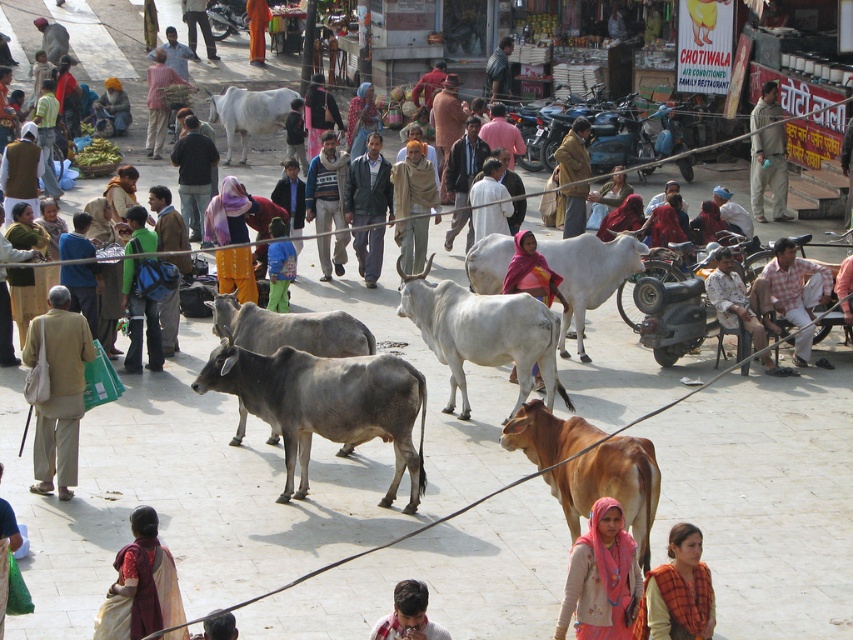
Is point (271, 358) more distant than point (515, 360)?

No, it is in front of (515, 360).

Is gray smooth bull at center thinner than white glossy bull at center?

In fact, gray smooth bull at center might be wider than white glossy bull at center.

Which is behind, point (271, 403) or point (451, 364)?

The point (451, 364) is more distant.

At what (x,y) coordinates should I click in order to perform the action: click on gray smooth bull at center. Please return your answer as a coordinate pair (x, y). The width and height of the screenshot is (853, 640). Looking at the image, I should click on (325, 404).

Between dark blue shirt at center and orange fabric pants at center, which one is positioned lower?

Positioned lower is dark blue shirt at center.

Does point (317, 129) come in front of point (260, 26)?

Yes, point (317, 129) is in front of point (260, 26).

Which is in front, point (318, 150) or point (247, 4)?

Point (318, 150)

Where is `dark blue shirt at center`? Image resolution: width=853 pixels, height=640 pixels. dark blue shirt at center is located at coordinates (318, 113).

Which is more to the right, matte purple scarf at center or dark gray hair at center?

dark gray hair at center is more to the right.

Locate an element on the screen. The image size is (853, 640). matte purple scarf at center is located at coordinates (228, 212).

Between point (221, 216) and point (209, 636), which one is positioned behind?

Point (221, 216)

Find the location of a particular element. matte purple scarf at center is located at coordinates (228, 212).